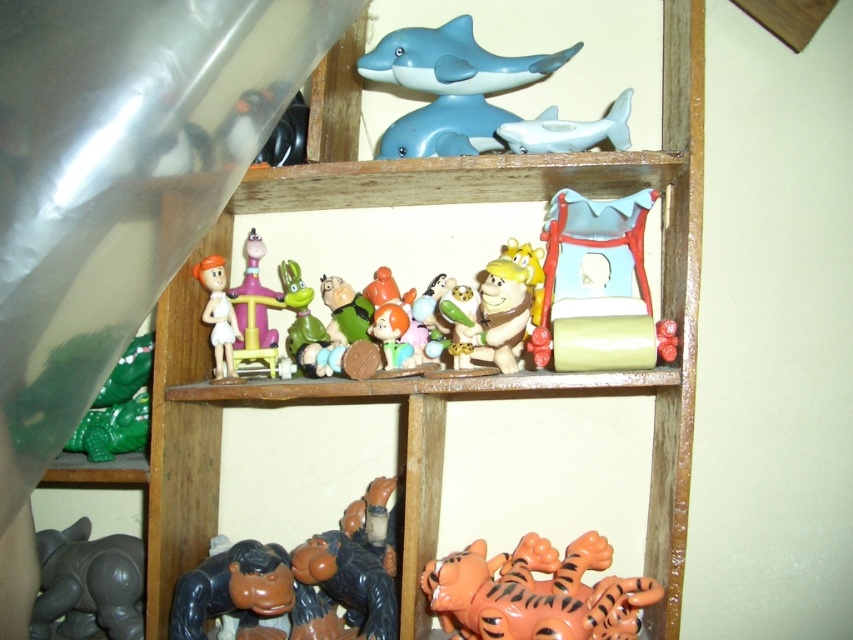
Question: Does satin white shark at upper center lie behind green matte toy at center?

Choices:
 (A) yes
 (B) no

Answer: (A)

Question: Which object is positioned farthest from the multicolored plastic figurines at center?

Choices:
 (A) matte plastic toy at center
 (B) orange matte tiger at lower center
 (C) satin white shark at upper center

Answer: (B)

Question: Is blue plastic dolphin at upper center bigger than green matte toy at lower left?

Choices:
 (A) no
 (B) yes

Answer: (B)

Question: Where is blue plastic dolphin at upper center located in relation to green matte toy at center in the image?

Choices:
 (A) above
 (B) below

Answer: (A)

Question: Which point appears closest to the camera in this image?

Choices:
 (A) (107, 401)
 (B) (456, 115)

Answer: (B)

Question: Which object appears closest to the camera in this image?

Choices:
 (A) green matte toy at center
 (B) matte plastic toy at center
 (C) satin white shark at upper center
 (D) multicolored plastic figurines at center

Answer: (D)